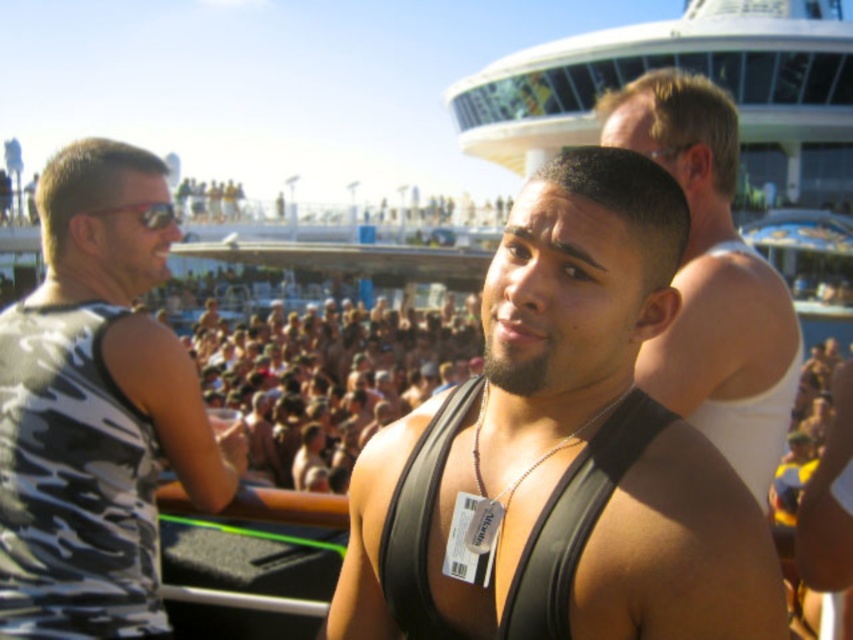
Who is shorter, black fabric tank top at right or black leather vest at center?

Standing shorter between the two is black leather vest at center.

Can you confirm if black fabric tank top at right is taller than black leather vest at center?

Yes, black fabric tank top at right is taller than black leather vest at center.

Between point (711, 154) and point (532, 573), which one is positioned behind?

The point (711, 154) is behind.

You are a GUI agent. You are given a task and a screenshot of the screen. Output one action in this format:
    pyautogui.click(x=<x>, y=<y>)
    Task: Click on the black fabric tank top at right
    This screenshot has height=640, width=853.
    Given the screenshot: What is the action you would take?
    pyautogui.click(x=712, y=280)

What do you see at coordinates (563, 449) in the screenshot? I see `black matte vest at center` at bounding box center [563, 449].

Is black matte vest at center bigger than camouflage tank top at left?

No.

You are a GUI agent. You are given a task and a screenshot of the screen. Output one action in this format:
    pyautogui.click(x=<x>, y=<y>)
    Task: Click on the black matte vest at center
    This screenshot has height=640, width=853.
    Given the screenshot: What is the action you would take?
    pyautogui.click(x=563, y=449)

At what (x,y) coordinates should I click in order to perform the action: click on black matte vest at center. Please return your answer as a coordinate pair (x, y). This screenshot has height=640, width=853. Looking at the image, I should click on (563, 449).

You are a GUI agent. You are given a task and a screenshot of the screen. Output one action in this format:
    pyautogui.click(x=<x>, y=<y>)
    Task: Click on the camouflage tank top at left
    Image resolution: width=853 pixels, height=640 pixels.
    Given the screenshot: What is the action you would take?
    pyautogui.click(x=94, y=410)

Does camouflage tank top at left lie behind black fabric tank top at right?

That is False.

Between point (120, 177) and point (712, 176), which one is positioned behind?

Positioned behind is point (712, 176).

Image resolution: width=853 pixels, height=640 pixels. I want to click on camouflage tank top at left, so click(x=94, y=410).